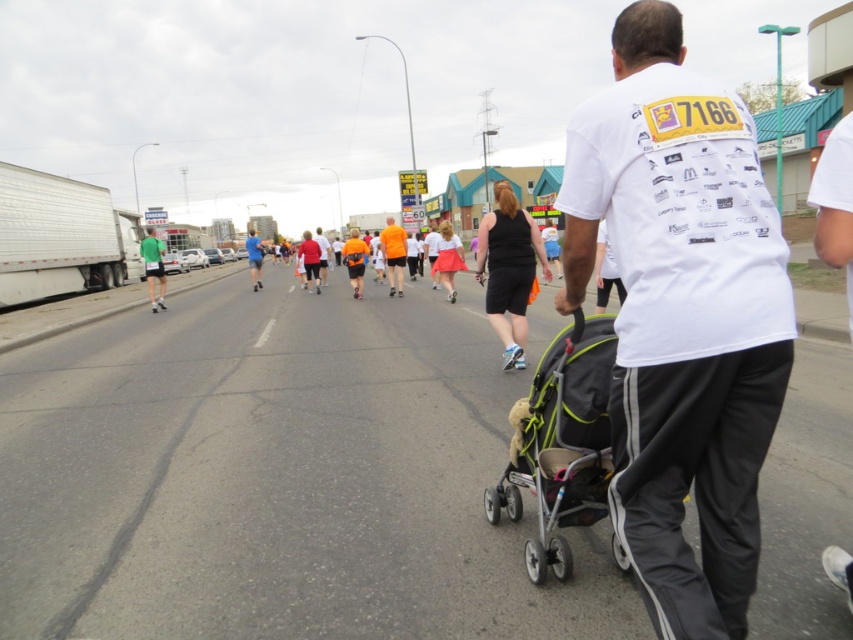
Question: Does green fabric shorts at left have a larger size compared to blue fabric shirt at center?

Choices:
 (A) yes
 (B) no

Answer: (B)

Question: Which of these objects is positioned closest to the white matte t-shirt at center?

Choices:
 (A) gray fabric stroller at center
 (B) black matte shorts at center

Answer: (A)

Question: Which of the following is the closest to the observer?

Choices:
 (A) (576, 280)
 (B) (387, 243)
 (C) (254, 264)

Answer: (A)

Question: Does white matte t-shirt at center appear on the right side of blue fabric shirt at center?

Choices:
 (A) yes
 (B) no

Answer: (A)

Question: Observing the image, what is the correct spatial positioning of white matte t-shirt at center in reference to green fabric shorts at left?

Choices:
 (A) right
 (B) left

Answer: (A)

Question: Estimate the real-world distances between objects in this image. Which object is closer to the green fabric shorts at left?

Choices:
 (A) orange fabric shirt at center
 (B) blue fabric shirt at center
 (C) white matte t-shirt at center
 (D) black matte shorts at center

Answer: (B)